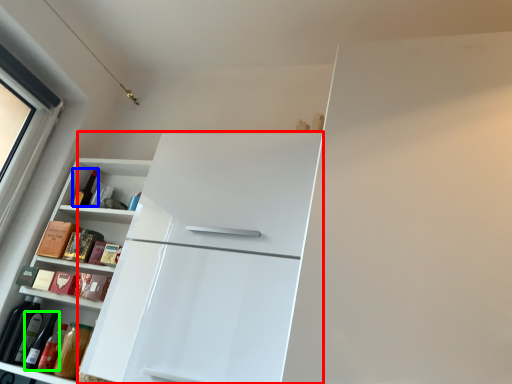
Question: Based on their relative distances, which object is farther from refrigerator (highlighted by a red box)? Choose from bottle (highlighted by a blue box) and wine bottle (highlighted by a green box).

Choices:
 (A) bottle
 (B) wine bottle

Answer: (A)